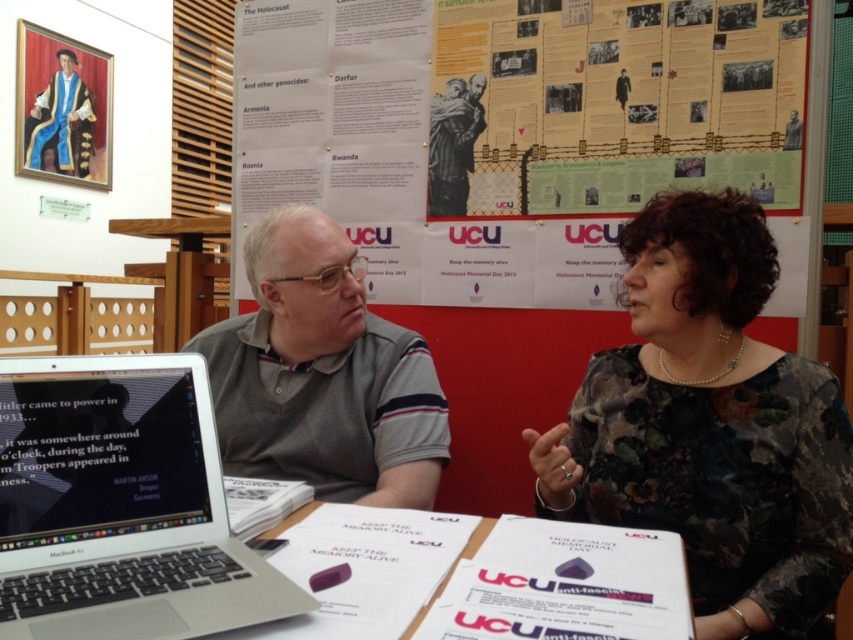
Question: Is silver metallic laptop at left above white paper at center?

Choices:
 (A) yes
 (B) no

Answer: (A)

Question: Which point is closer to the camera taking this photo?

Choices:
 (A) [252, 333]
 (B) [402, 124]

Answer: (A)

Question: Does silver metallic laptop at left have a greater width compared to white paper at center?

Choices:
 (A) yes
 (B) no

Answer: (B)

Question: Based on their relative distances, which object is nearer to the yellow paper poster at upper center?

Choices:
 (A) white paper at center
 (B) silver metallic laptop at left

Answer: (A)

Question: Is the position of floral-patterned fabric at center less distant than that of gray cotton shirt at center?

Choices:
 (A) no
 (B) yes

Answer: (B)

Question: Which object is positioned closest to the yellow paper poster at upper center?

Choices:
 (A) silver metallic laptop at left
 (B) white paper at center
 (C) gray cotton shirt at center

Answer: (C)